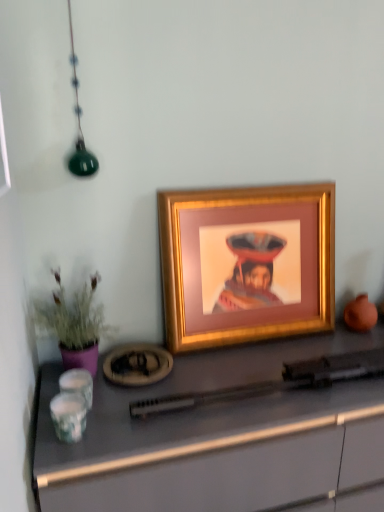
Image resolution: width=384 pixels, height=512 pixels. I want to click on free space above matte gray desk at center (from a real-world perspective), so click(x=242, y=359).